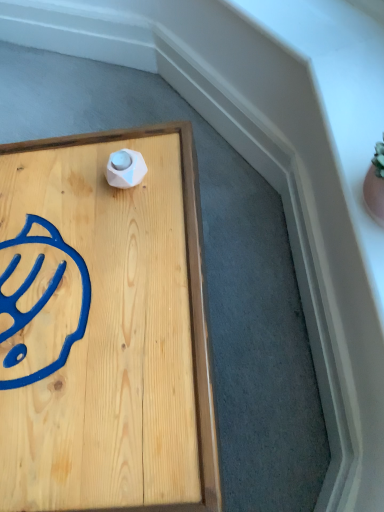
Describe the element at coordinates (104, 328) in the screenshot. I see `natural wood table at center` at that location.

Where is `natural wood table at center`? Image resolution: width=384 pixels, height=512 pixels. natural wood table at center is located at coordinates (104, 328).

The image size is (384, 512). I want to click on natural wood table at center, so click(x=104, y=328).